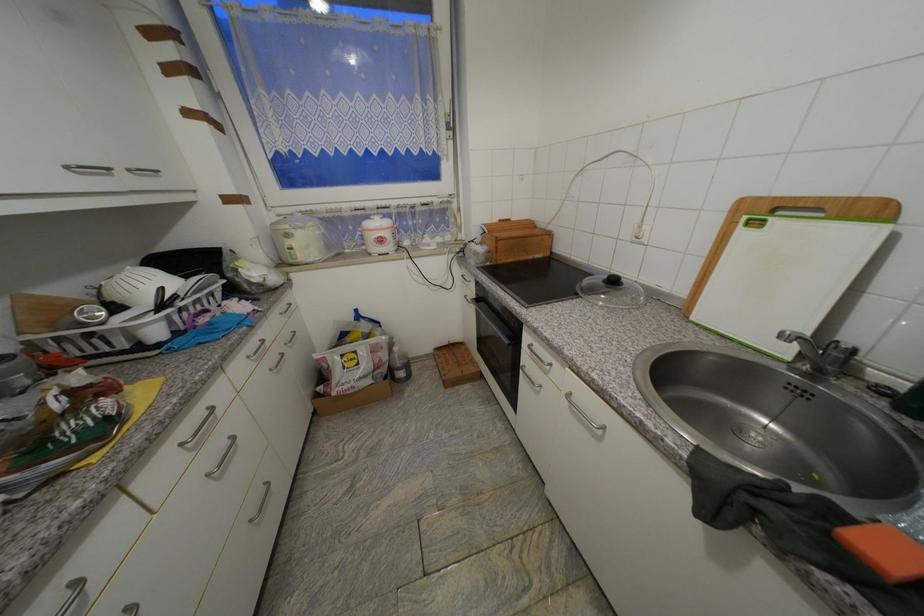
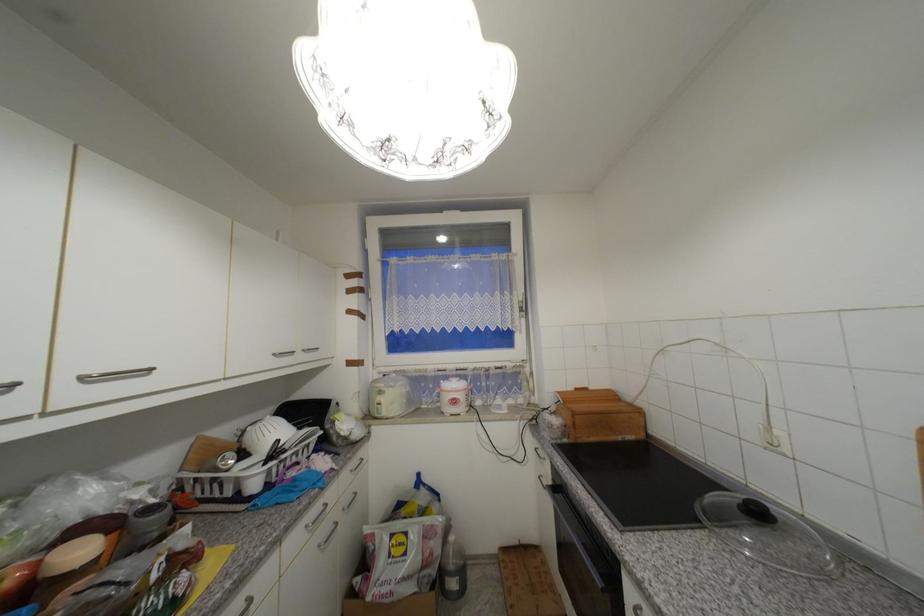
Locate, in the second image, the point that corresponds to (x=502, y=223) in the first image.

(576, 390)